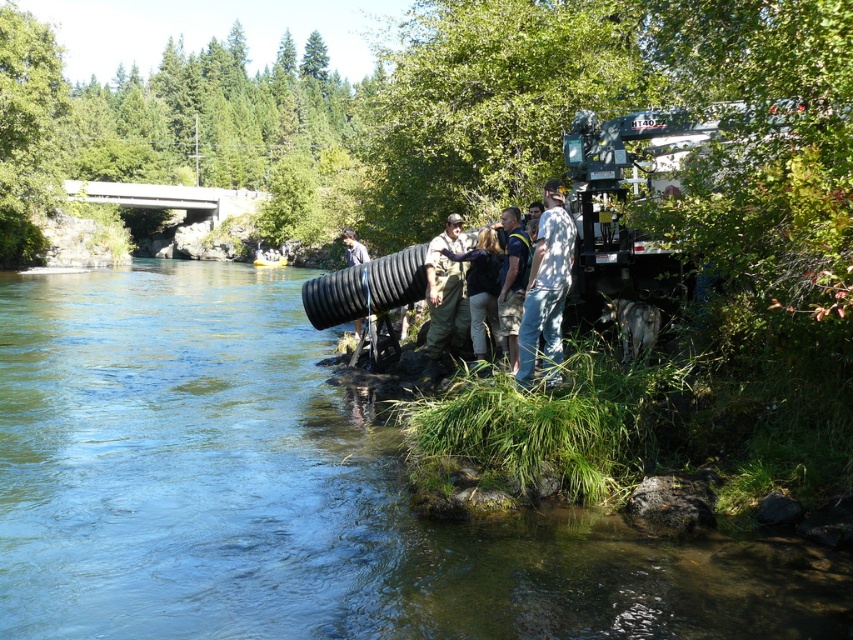
Consider the image. Does camouflage pants at center have a lesser height compared to denim jeans at center?

Correct, camouflage pants at center is not as tall as denim jeans at center.

Does camouflage pants at center appear under denim jeans at center?

Yes.

Is point (523, 337) positioned after point (556, 260)?

Yes, point (523, 337) is behind point (556, 260).

Find the location of a particular element. This screenshot has width=853, height=640. camouflage pants at center is located at coordinates (540, 285).

Between point (256, 429) and point (480, 332), which one is positioned behind?

Positioned behind is point (480, 332).

Is clear water at river right further to the viewer compared to dark brown leather jacket at center?

No.

Identify the location of clear water at river right. Image resolution: width=853 pixels, height=640 pixels. (299, 493).

Looking at this image, can you confirm if denim jeans at center is positioned to the left of dark brown leather jacket at center?

No, denim jeans at center is not to the left of dark brown leather jacket at center.

Looking at this image, is denim jeans at center taller than dark brown leather jacket at center?

Correct, denim jeans at center is much taller as dark brown leather jacket at center.

The height and width of the screenshot is (640, 853). What do you see at coordinates (546, 289) in the screenshot?
I see `denim jeans at center` at bounding box center [546, 289].

What are the coordinates of `denim jeans at center` in the screenshot? It's located at (546, 289).